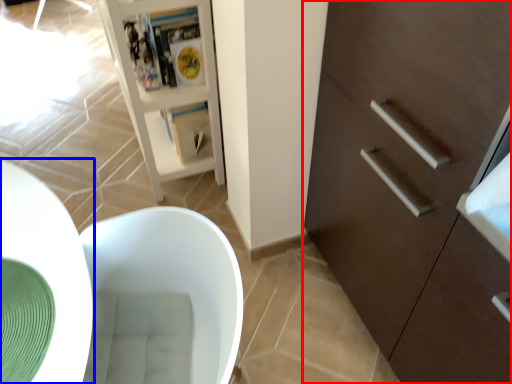
Question: Which point is further to the camera, cabinetry (highlighted by a red box) or round table (highlighted by a blue box)?

Choices:
 (A) cabinetry
 (B) round table

Answer: (A)